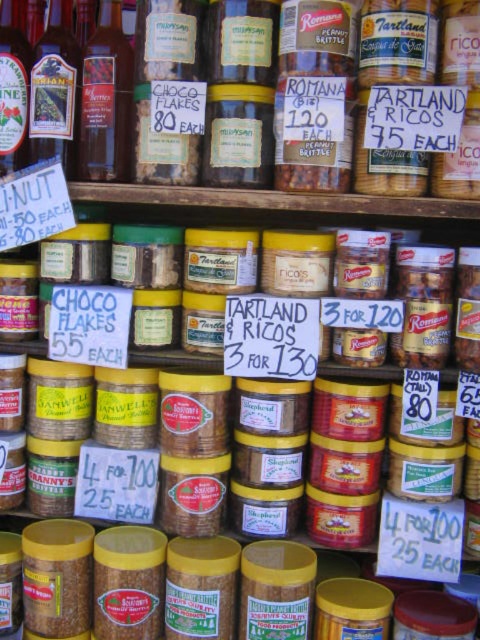
You are standing in front of the display of jars and containers. There are two points marked on the display. One is at coordinate point (112,180) and the other is at point (10,76). If you were to reach out to touch these points, which one would you need to extend your hand further to reach?

Point (10,76) is closer to you than point (112,180). Therefore, you would need to extend your hand further to reach point (112,180) because it is farther away from you.

You are a customer looking at the shelves and want to choose a taller bottle between the translucent glass bottle at upper left and the matte glass bottle at upper left. Which one should you pick?

The translucent glass bottle at upper left is taller than the matte glass bottle at upper left, so you should choose the translucent glass bottle at upper left.